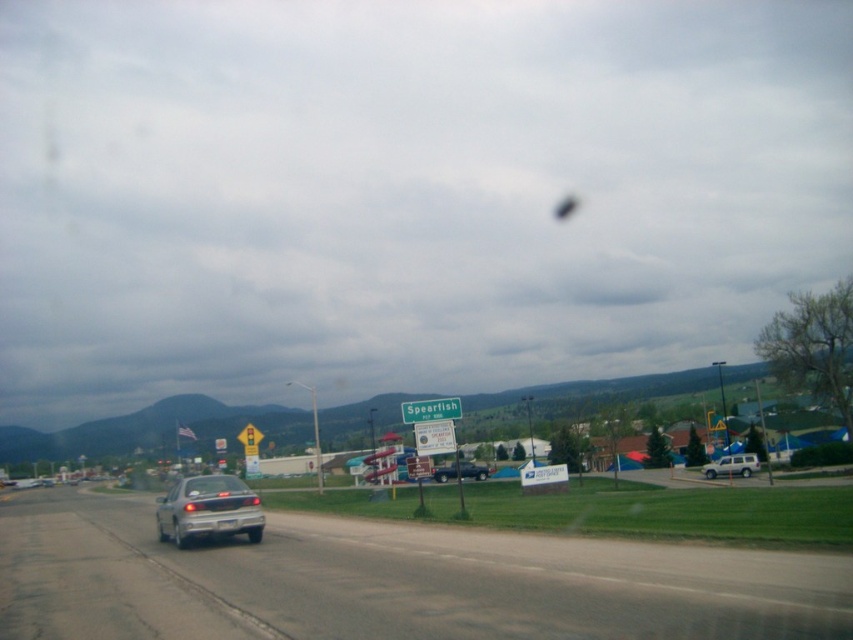
Which is behind, point (206, 483) or point (480, 474)?

The point (480, 474) is more distant.

Can you confirm if satin silver sedan at lower left is positioned above metallic blue truck at center?

Yes.

Is point (241, 515) closer to camera compared to point (471, 464)?

Yes, it is in front of point (471, 464).

Where is `satin silver sedan at lower left`? This screenshot has width=853, height=640. satin silver sedan at lower left is located at coordinates (207, 509).

Is white matte suv at right smaller than metallic blue truck at center?

Indeed, white matte suv at right has a smaller size compared to metallic blue truck at center.

Does white matte suv at right appear on the right side of metallic blue truck at center?

Indeed, white matte suv at right is positioned on the right side of metallic blue truck at center.

Image resolution: width=853 pixels, height=640 pixels. What do you see at coordinates (732, 465) in the screenshot?
I see `white matte suv at right` at bounding box center [732, 465].

This screenshot has width=853, height=640. In order to click on white matte suv at right in this screenshot , I will do `click(732, 465)`.

Is silver metallic car at lower left bigger than white matte suv at right?

Indeed, silver metallic car at lower left has a larger size compared to white matte suv at right.

This screenshot has width=853, height=640. What do you see at coordinates (390, 582) in the screenshot? I see `silver metallic car at lower left` at bounding box center [390, 582].

Between point (338, 560) and point (743, 474), which one is positioned in front?

Positioned in front is point (338, 560).

Identify the location of silver metallic car at lower left. (390, 582).